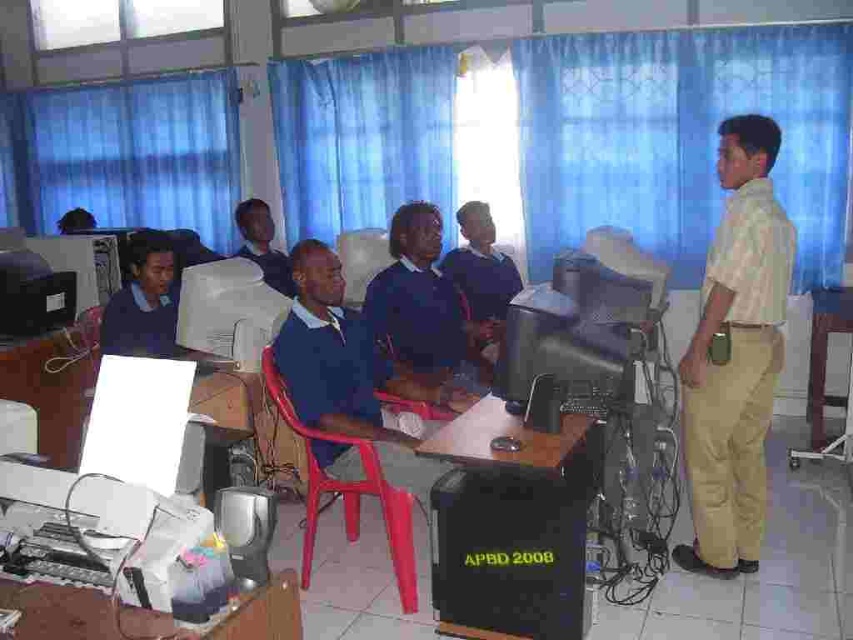
Locate an element on the screen. white plastic printer at lower left is located at coordinates (53, 387).

Is white plastic printer at lower left wider than matte blue sweater at left?

Yes, white plastic printer at lower left is wider than matte blue sweater at left.

Image resolution: width=853 pixels, height=640 pixels. In order to click on white plastic printer at lower left in this screenshot , I will do `click(53, 387)`.

Who is positioned more to the left, blue matte shirt at center or wooden table at right?

blue matte shirt at center

Is blue matte shirt at center to the right of wooden table at right from the viewer's perspective?

In fact, blue matte shirt at center is to the left of wooden table at right.

Image resolution: width=853 pixels, height=640 pixels. What are the coordinates of `blue matte shirt at center` in the screenshot? It's located at (346, 371).

Is wooden table at center smaller than red plastic chair at center?

Yes.

Is point (582, 488) positioned before point (410, 506)?

No, (582, 488) is further to viewer.

Identify the location of wooden table at center. This screenshot has height=640, width=853. (509, 525).